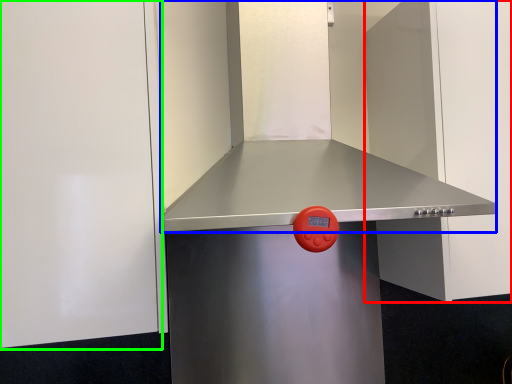
Question: Based on their relative distances, which object is nearer to door (highlighted by a red box)? Choose from vent (highlighted by a blue box) and door (highlighted by a green box).

Choices:
 (A) vent
 (B) door

Answer: (A)